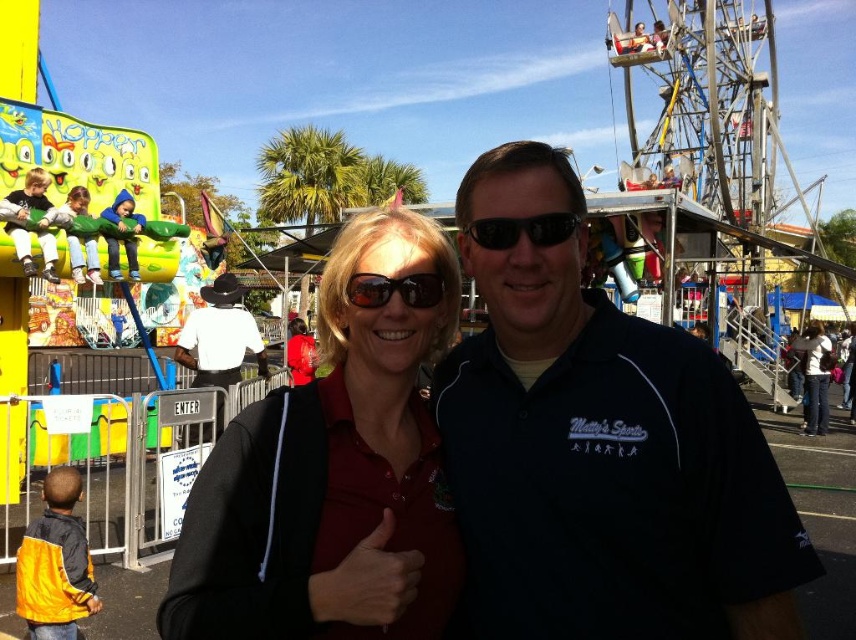
You are a photographer trying to capture a clear shot of the dark blue shirt at center and the sunglasses at center. Which object is closer to the camera?

The dark blue shirt at center is closer to the camera since it is in front of the sunglasses at center.